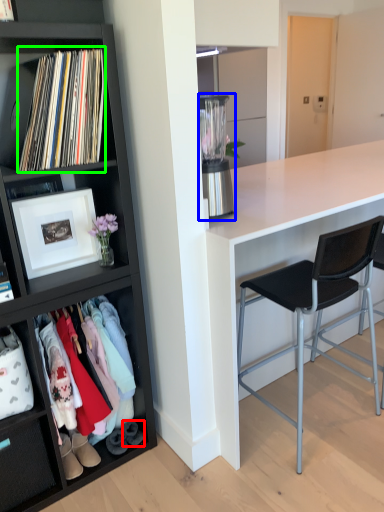
Question: Based on their relative distances, which object is nearer to shoe (highlighted by a red box)? Choose from appliance (highlighted by a blue box) and book (highlighted by a green box).

Choices:
 (A) appliance
 (B) book

Answer: (A)